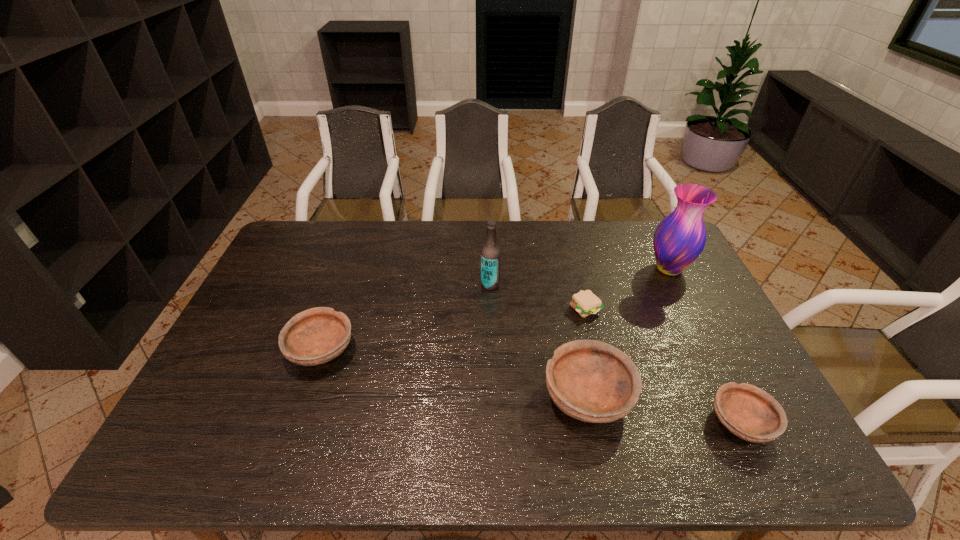
To make them evenly spaced by inserting another bowl among them, please locate a vacant spot for this new bowl. Please provide its 2D coordinates. Your answer should be formatted as a tuple, i.e. [(x, y)], where the tuple contains the x and y coordinates of a point satisfying the conditions above.

[(448, 372)]